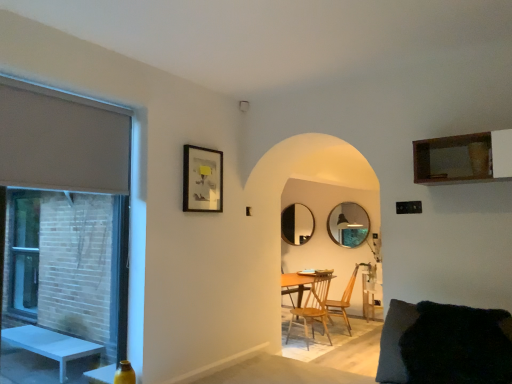
Question: Is black fuzzy pillow at lower right located outside matte glass window at left?

Choices:
 (A) no
 (B) yes

Answer: (B)

Question: From a real-world perspective, is black fuzzy pillow at lower right over matte glass window at left?

Choices:
 (A) no
 (B) yes

Answer: (A)

Question: Considering the relative sizes of black fuzzy pillow at lower right and matte glass window at left in the image provided, is black fuzzy pillow at lower right wider than matte glass window at left?

Choices:
 (A) yes
 (B) no

Answer: (A)

Question: Is black fuzzy pillow at lower right positioned before matte glass window at left?

Choices:
 (A) no
 (B) yes

Answer: (B)

Question: Is black fuzzy pillow at lower right further to camera compared to matte glass window at left?

Choices:
 (A) no
 (B) yes

Answer: (A)

Question: Considering the relative sizes of black fuzzy pillow at lower right and matte glass window at left in the image provided, is black fuzzy pillow at lower right smaller than matte glass window at left?

Choices:
 (A) yes
 (B) no

Answer: (B)

Question: Is matte black picture frame at upper left smaller than black glass mirror at center, which ranks as the second mirror in front-to-back order?

Choices:
 (A) yes
 (B) no

Answer: (A)

Question: Is matte black picture frame at upper left facing towards black glass mirror at center, the first mirror from the left?

Choices:
 (A) yes
 (B) no

Answer: (B)

Question: Considering the relative sizes of matte black picture frame at upper left and black glass mirror at center, the first mirror from the left, in the image provided, is matte black picture frame at upper left wider than black glass mirror at center, the first mirror from the left,?

Choices:
 (A) no
 (B) yes

Answer: (A)

Question: Can you confirm if matte black picture frame at upper left is taller than black glass mirror at center, the first mirror from the left?

Choices:
 (A) no
 (B) yes

Answer: (A)

Question: Is matte black picture frame at upper left outside of black glass mirror at center, which appears as the 2th mirror when viewed from the right?

Choices:
 (A) no
 (B) yes

Answer: (B)

Question: Is matte black picture frame at upper left surrounding black glass mirror at center, positioned as the first mirror in back-to-front order?

Choices:
 (A) no
 (B) yes

Answer: (A)

Question: Considering the relative sizes of black glass mirror at center, the first mirror from the left, and matte black picture frame at upper left in the image provided, is black glass mirror at center, the first mirror from the left, wider than matte black picture frame at upper left?

Choices:
 (A) yes
 (B) no

Answer: (A)